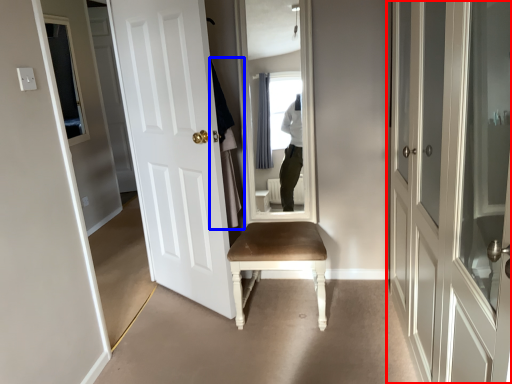
Question: Which of the following is the farthest to the observer, door (highlighted by a red box) or robe (highlighted by a blue box)?

Choices:
 (A) door
 (B) robe

Answer: (B)